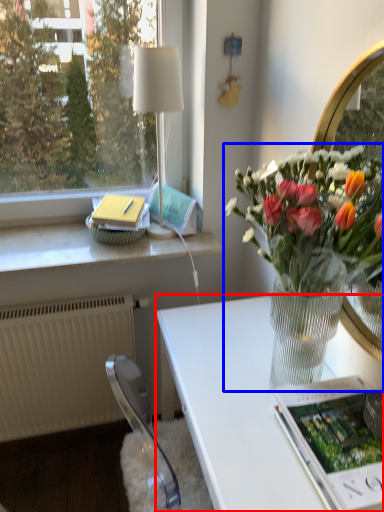
Question: Which object is closer to the camera taking this photo, desk (highlighted by a red box) or houseplant (highlighted by a blue box)?

Choices:
 (A) desk
 (B) houseplant

Answer: (B)